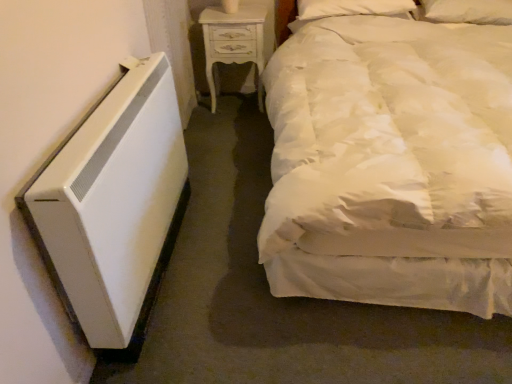
Question: From the image's perspective, is white soft pillow at upper right, which ranks as the second pillow in left-to-right order, located above or below white soft pillow at upper right, which ranks as the 2th pillow in right-to-left order?

Choices:
 (A) above
 (B) below

Answer: (B)

Question: Is white soft pillow at upper right, which ranks as the second pillow in left-to-right order, bigger or smaller than white soft pillow at upper right, the first pillow positioned from the left?

Choices:
 (A) big
 (B) small

Answer: (A)

Question: Based on their relative distances, which object is nearer to the white satin bed at right?

Choices:
 (A) white soft pillow at upper right, positioned as the 1th pillow in right-to-left order
 (B) white soft pillow at upper right, the first pillow positioned from the left
 (C) white painted wood nightstand at upper center

Answer: (C)

Question: Which object is positioned farthest from the white soft pillow at upper right, which ranks as the second pillow in left-to-right order?

Choices:
 (A) white painted wood nightstand at upper center
 (B) white satin bed at right
 (C) white soft pillow at upper right, the first pillow positioned from the left

Answer: (B)